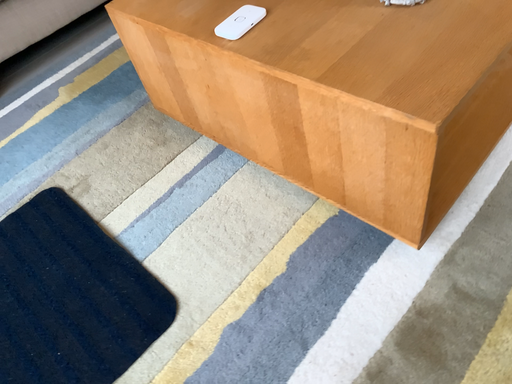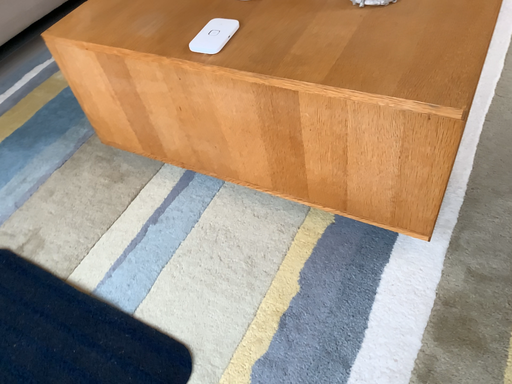
Question: Which way did the camera rotate in the video?

Choices:
 (A) rotated left
 (B) rotated right

Answer: (B)